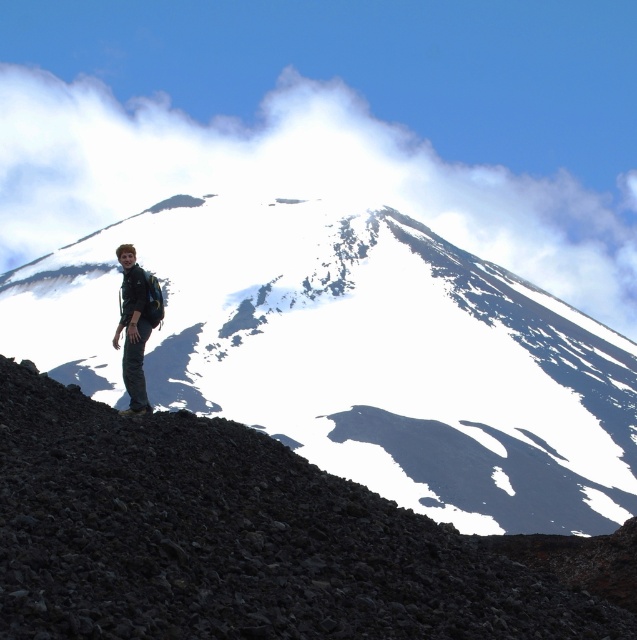
You are a photographer planning to capture a landscape shot of the snowy rocky mountain at center and dark gray gravel at lower left. Based on their sizes, which object should you focus on to ensure both fit in the frame?

The snowy rocky mountain at center might be wider than dark gray gravel at lower left, so focusing on the wider snowy rocky mountain at center would ensure both fit in the frame.

You are a photographer trying to capture the entire snowy rocky mountain at center and the matte black jacket at lower left in one frame. Based on their sizes in the image, which object would require you to adjust your camera to a wider angle to ensure both fit in the frame?

The snowy rocky mountain at center requires a wider angle because its width is larger than the matte black jacket at lower left.

You are a photographer planning to take a landscape photo of the snowy rocky mountain at center and the white fluffy cloud at upper center. If you want to emphasize the mountain, should you adjust your camera to focus on a closer or farther distance compared to the cloud?

The snowy rocky mountain at center is smaller than the white fluffy cloud at upper center. To emphasize the mountain, you should focus on a closer distance since the mountain is nearer to the camera than the cloud.